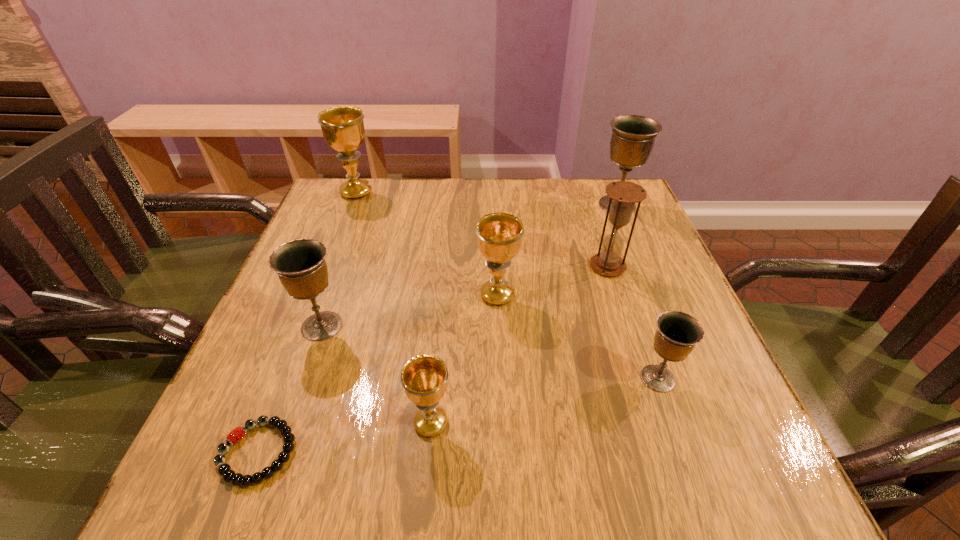
Locate an element on the screen. This screenshot has height=540, width=960. the leftmost gold chalice is located at coordinates (343, 129).

Locate an element on the screen. The image size is (960, 540). the farthest gold chalice is located at coordinates (343, 129).

You are a GUI agent. You are given a task and a screenshot of the screen. Output one action in this format:
    pyautogui.click(x=<x>, y=<y>)
    Task: Click on the farthest bronze chalice
    The image size is (960, 540).
    Given the screenshot: What is the action you would take?
    pyautogui.click(x=632, y=141)

At what (x,y) coordinates should I click in order to perform the action: click on hourglass. Please return your answer as a coordinate pair (x, y). Looking at the image, I should click on (625, 194).

What are the coordinates of `the third farthest object` in the screenshot? It's located at (625, 194).

You are a GUI agent. You are given a task and a screenshot of the screen. Output one action in this format:
    pyautogui.click(x=<x>, y=<y>)
    Task: Click on the leftmost bronze chalice
    This screenshot has height=540, width=960.
    Given the screenshot: What is the action you would take?
    pyautogui.click(x=300, y=264)

Identify the location of the second biggest bronze chalice. This screenshot has height=540, width=960. (300, 264).

You are a GUI agent. You are given a task and a screenshot of the screen. Output one action in this format:
    pyautogui.click(x=<x>, y=<y>)
    Task: Click on the second smallest gold chalice
    This screenshot has height=540, width=960.
    Given the screenshot: What is the action you would take?
    pyautogui.click(x=499, y=235)

The width and height of the screenshot is (960, 540). What are the coordinates of `the fifth object from left to right` in the screenshot? It's located at (499, 235).

You are a GUI agent. You are given a task and a screenshot of the screen. Output one action in this format:
    pyautogui.click(x=<x>, y=<y>)
    Task: Click on the fourth chalice from right to left
    
    Given the screenshot: What is the action you would take?
    pyautogui.click(x=424, y=378)